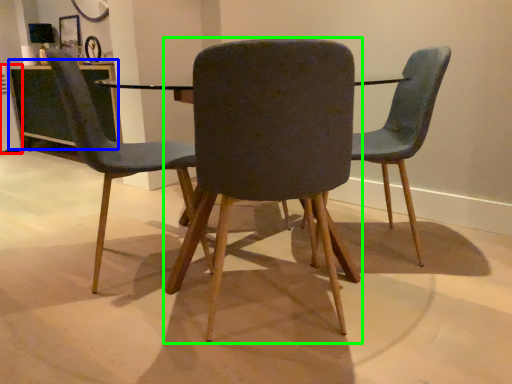
Question: Considering the real-world distances, which object is farthest from appliance (highlighted by a red box)? table (highlighted by a blue box) or chair (highlighted by a green box)?

Choices:
 (A) table
 (B) chair

Answer: (B)